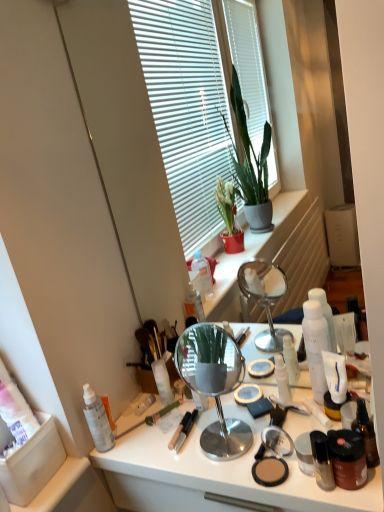
Question: From a real-world perspective, relative to white glossy lotion at center, placed as the third toiletry when sorted from left to right, is polished silver mirror at center vertically above or below?

Choices:
 (A) above
 (B) below

Answer: (A)

Question: Considering their positions, is polished silver mirror at center located in front of or behind white glossy lotion at center, placed as the fifth toiletry when sorted from right to left?

Choices:
 (A) behind
 (B) front

Answer: (B)

Question: Which of these objects is positioned farthest from the matte brown jar at lower right, marked as the second toiletry in a right-to-left arrangement?

Choices:
 (A) transparent plastic spray bottle at left, the 7th toiletry in the right-to-left sequence
 (B) shiny black bottle at lower right, the 4th toiletry viewed from the right
 (C) matte brown compact at lower center
 (D) white matte lotion at right, the fifth toiletry positioned from the left
 (E) polished silver mirror at center

Answer: (A)

Question: Which of these objects is positioned farthest from the shiny black bottle at lower right, which is counted as the fourth toiletry, starting from the left?

Choices:
 (A) green plastic paint brush at lower left
 (B) matte brown jar at lower right, marked as the second toiletry in a right-to-left arrangement
 (C) metallic silver mirror at center
 (D) transparent plastic spray bottle at left, the 1th toiletry in the left-to-right sequence
 (E) white plastic container at center, positioned as the 2th toiletry in left-to-right order

Answer: (D)